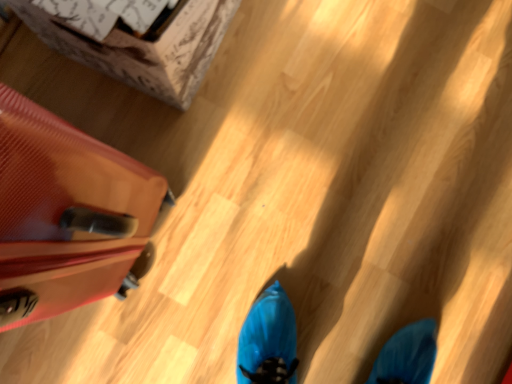
Question: From a real-world perspective, is matte red suitcase at left above or below brown cardboard box at upper left?

Choices:
 (A) below
 (B) above

Answer: (B)

Question: Is matte red suitcase at left in front of or behind brown cardboard box at upper left in the image?

Choices:
 (A) behind
 (B) front

Answer: (B)

Question: Considering the positions of matte red suitcase at left and brown cardboard box at upper left in the image, is matte red suitcase at left taller or shorter than brown cardboard box at upper left?

Choices:
 (A) short
 (B) tall

Answer: (B)

Question: From the image's perspective, is brown cardboard box at upper left above or below matte red suitcase at left?

Choices:
 (A) below
 (B) above

Answer: (B)

Question: Based on their sizes in the image, would you say brown cardboard box at upper left is bigger or smaller than matte red suitcase at left?

Choices:
 (A) big
 (B) small

Answer: (B)

Question: Considering their positions, is brown cardboard box at upper left located in front of or behind matte red suitcase at left?

Choices:
 (A) front
 (B) behind

Answer: (B)

Question: In terms of height, does brown cardboard box at upper left look taller or shorter compared to matte red suitcase at left?

Choices:
 (A) tall
 (B) short

Answer: (B)